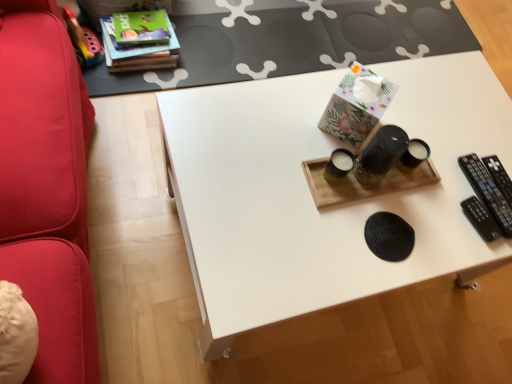
This screenshot has height=384, width=512. Identify the location of free space in front of black plastic remote at right. (458, 234).